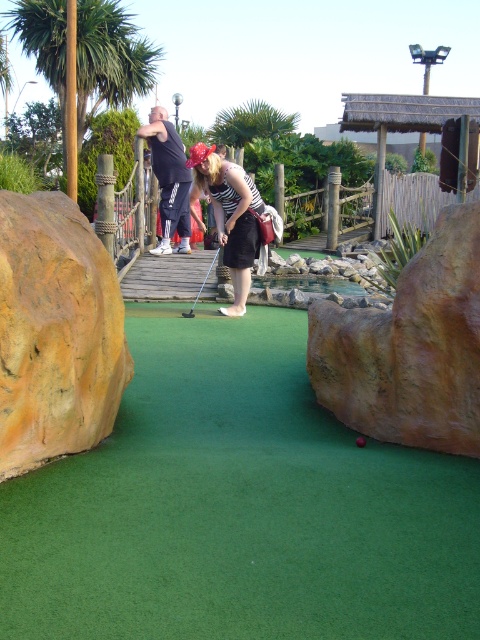
Question: Estimate the real-world distances between objects in this image. Which object is farther from the striped fabric shirt at center?

Choices:
 (A) metallic silver golf club at center
 (B) smooth red golf ball at center
 (C) dark blue track pants at center
 (D) green artificial turf at center

Answer: (B)

Question: Can you confirm if green artificial turf at center is positioned below striped fabric shirt at center?

Choices:
 (A) yes
 (B) no

Answer: (A)

Question: Which of the following is the closest to the observer?

Choices:
 (A) (163, 420)
 (B) (214, 198)

Answer: (A)

Question: Which object is farther from the camera taking this photo?

Choices:
 (A) striped fabric shirt at center
 (B) metallic silver golf club at center

Answer: (B)

Question: Can you confirm if striped fabric shirt at center is positioned to the left of metallic silver golf club at center?

Choices:
 (A) no
 (B) yes

Answer: (A)

Question: Is green artificial turf at center below metallic silver golf club at center?

Choices:
 (A) yes
 (B) no

Answer: (A)